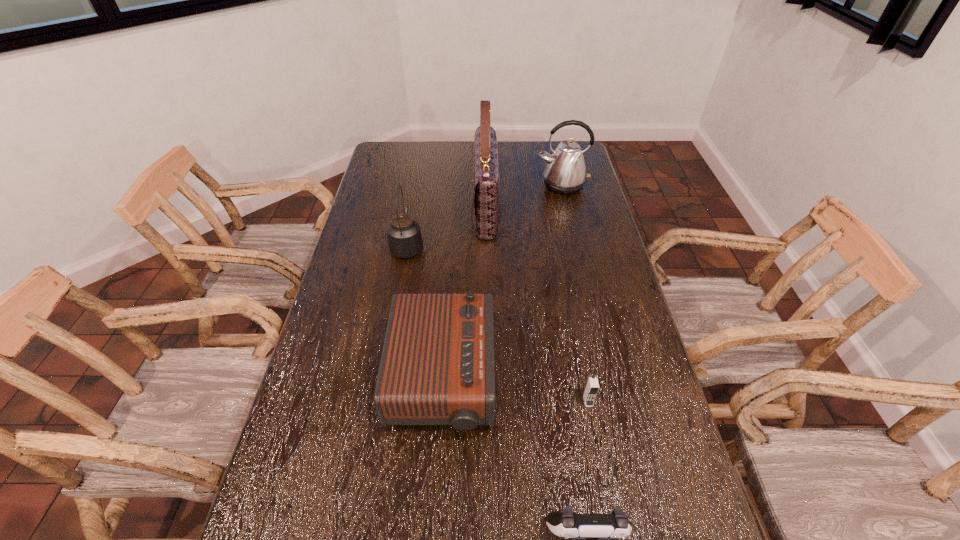
In order to click on handbag in this screenshot , I will do `click(486, 189)`.

Locate an element on the screen. The image size is (960, 540). the farther kettle is located at coordinates (565, 173).

Identify the location of the left kettle. (405, 240).

Find the location of a particular element. The height and width of the screenshot is (540, 960). the fourth tallest object is located at coordinates (437, 367).

The width and height of the screenshot is (960, 540). In order to click on the fifth tallest object in this screenshot , I will do `click(591, 389)`.

Find the location of a particular element. The height and width of the screenshot is (540, 960). free location located 0.340m on the front of the handbag with the clasp is located at coordinates (385, 207).

Identify the location of free space located on the front of the handbag with the clasp. This screenshot has width=960, height=540. (385, 207).

I want to click on free space located on the front of the handbag with the clasp, so 419,207.

This screenshot has width=960, height=540. Identify the location of free space located 0.190m from the spout of the farther kettle. (572, 227).

Locate an element on the screen. This screenshot has width=960, height=540. vacant space positioned 0.350m spout on the nearer kettle is located at coordinates (420, 179).